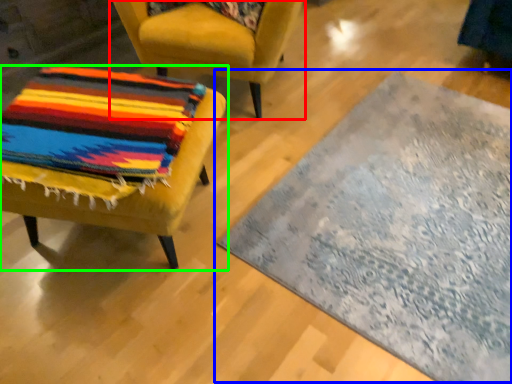
Question: Based on their relative distances, which object is nearer to chair (highlighted by a red box)? Choose from mat (highlighted by a blue box) and chair (highlighted by a green box).

Choices:
 (A) mat
 (B) chair

Answer: (B)